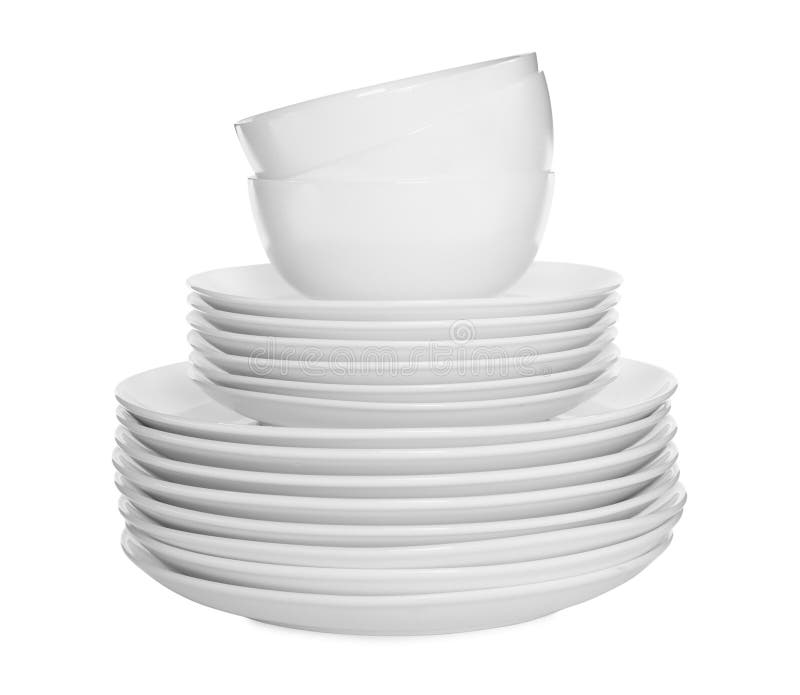
Locate an element on the screen. dinner plates is located at coordinates (616, 407), (598, 439), (594, 461), (578, 491), (569, 518), (548, 543), (528, 566), (506, 603).